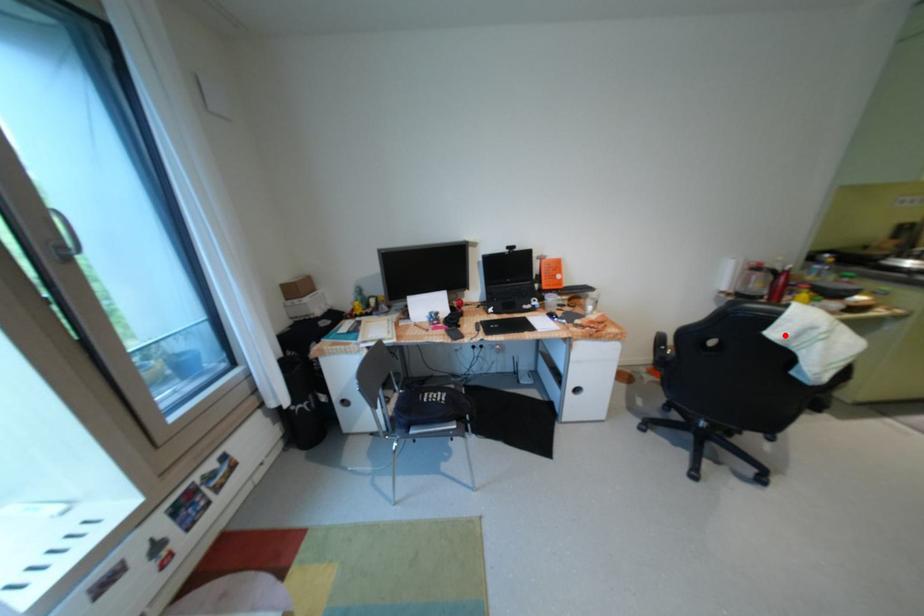
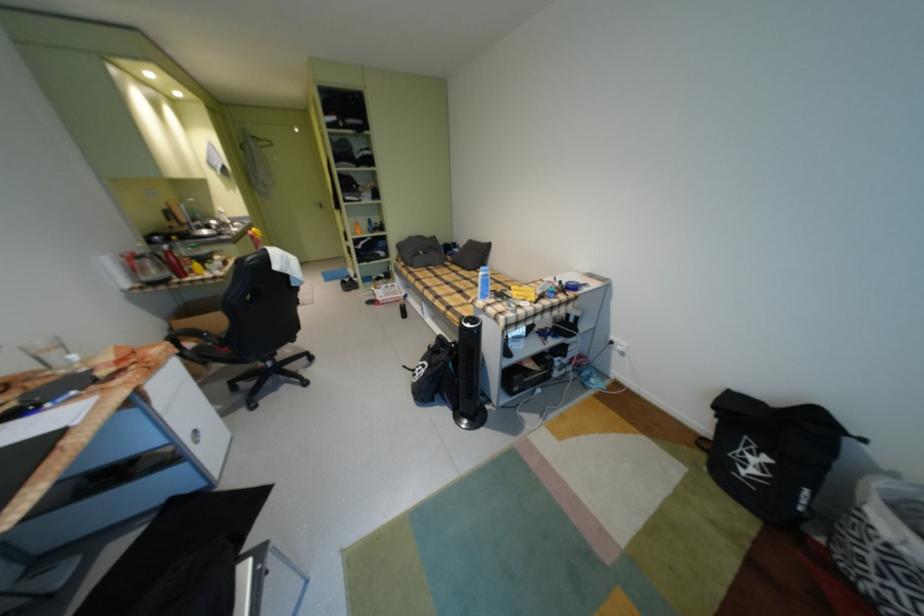
Locate, in the second image, the point that corresponds to the highlighted location in the first image.

(286, 268)